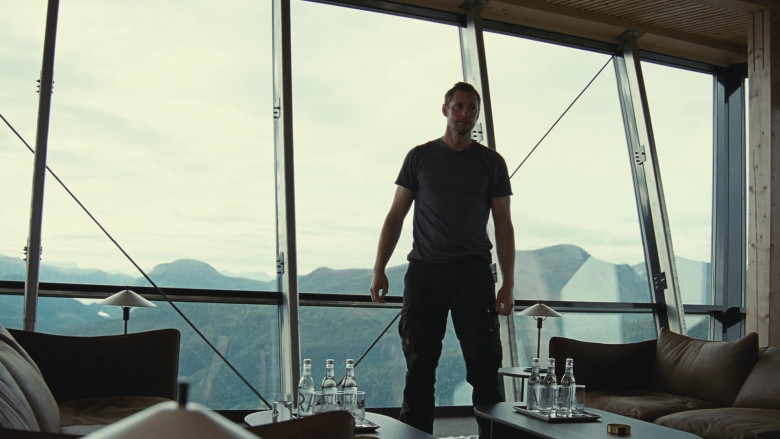
Locate an element on the screen. The height and width of the screenshot is (439, 780). lamps is located at coordinates (539, 315), (123, 300).